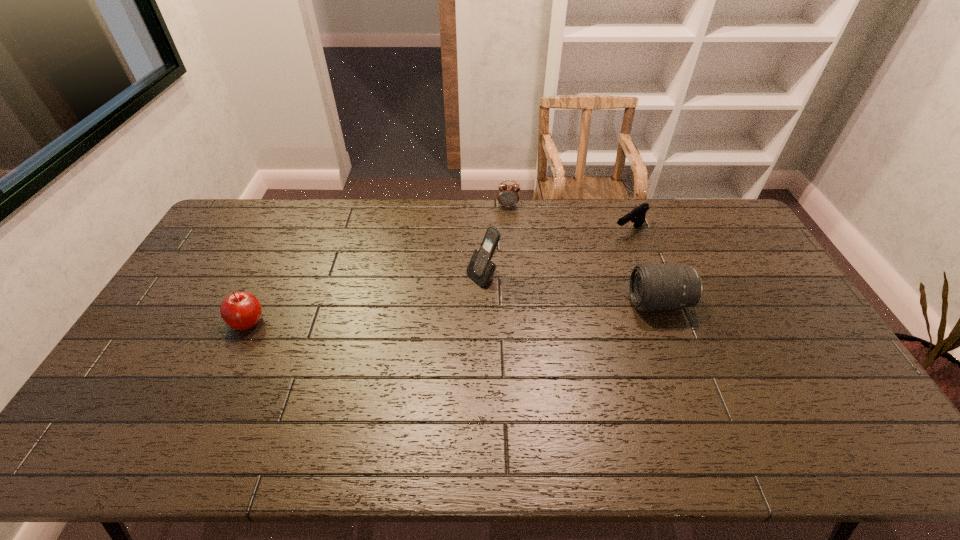
Identify the location of free space located on the surface of the telephoto lens. (568, 303).

You are a GUI agent. You are given a task and a screenshot of the screen. Output one action in this format:
    pyautogui.click(x=<x>, y=<y>)
    Task: Click on the free location located on the surface of the telephoto lens
    The height and width of the screenshot is (540, 960).
    Given the screenshot: What is the action you would take?
    pyautogui.click(x=514, y=303)

Where is `blank space located 0.220m on the face of the farthest object`? Image resolution: width=960 pixels, height=540 pixels. blank space located 0.220m on the face of the farthest object is located at coordinates (508, 247).

Where is `vacant space situated on the face of the farthest object`? Image resolution: width=960 pixels, height=540 pixels. vacant space situated on the face of the farthest object is located at coordinates (508, 273).

This screenshot has height=540, width=960. What are the coordinates of `free location located on the face of the farthest object` in the screenshot? It's located at (508, 232).

Where is `free region located on the front-facing side of the tallest object`? The height and width of the screenshot is (540, 960). free region located on the front-facing side of the tallest object is located at coordinates (452, 294).

The height and width of the screenshot is (540, 960). I want to click on vacant region located 0.140m on the front-facing side of the tallest object, so click(434, 305).

The image size is (960, 540). I want to click on blank space located 0.400m on the front-facing side of the tallest object, so click(358, 349).

Where is `free space located 0.060m on the front-facing side of the pistol`? Image resolution: width=960 pixels, height=540 pixels. free space located 0.060m on the front-facing side of the pistol is located at coordinates (606, 245).

The image size is (960, 540). Identify the location of vacant space located 0.170m on the front-facing side of the pistol. coord(586,259).